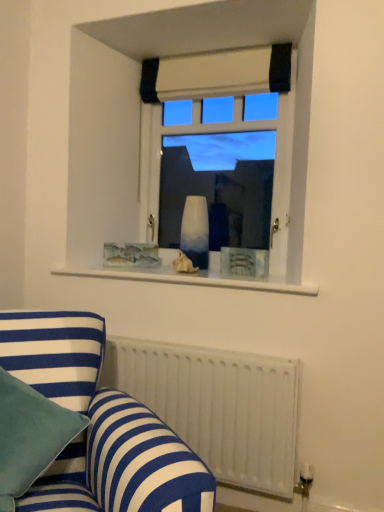
What do you see at coordinates (195, 231) in the screenshot? The width and height of the screenshot is (384, 512). I see `white glass vase at center` at bounding box center [195, 231].

The height and width of the screenshot is (512, 384). I want to click on beige fabric curtain at upper center, so click(217, 74).

Image resolution: width=384 pixels, height=512 pixels. What do you see at coordinates (217, 74) in the screenshot?
I see `beige fabric curtain at upper center` at bounding box center [217, 74].

Identify the location of white glass vase at upper center. This screenshot has height=512, width=384. (215, 74).

What is the approximate height of white glass vase at upper center?

white glass vase at upper center is 3.95 feet in height.

Identify the location of white metallic radiator at lower right. The image size is (384, 512). (218, 407).

Is blue striped fabric couch at lower left smaller than white metallic radiator at lower right?

No.

Is blue striped fabric couch at lower left closer to the viewer compared to white metallic radiator at lower right?

Yes, the depth of blue striped fabric couch at lower left is less than that of white metallic radiator at lower right.

Between blue striped fabric couch at lower left and white metallic radiator at lower right, which one has less height?

With less height is white metallic radiator at lower right.

Is the surface of blue striped fabric couch at lower left in direct contact with beige fabric curtain at upper center?

No, blue striped fabric couch at lower left is not with beige fabric curtain at upper center.

From a real-world perspective, is blue striped fabric couch at lower left physically below beige fabric curtain at upper center?

Correct, in the physical world, blue striped fabric couch at lower left is lower than beige fabric curtain at upper center.

Does point (95, 314) lie behind point (217, 93)?

No, it is not.

Looking at this image, which is more to the right, beige fabric curtain at upper center or teal velvet pillow at lower left?

beige fabric curtain at upper center is more to the right.

Does beige fabric curtain at upper center touch teal velvet pillow at lower left?

No, beige fabric curtain at upper center is not touching teal velvet pillow at lower left.

Looking at their sizes, would you say beige fabric curtain at upper center is wider or thinner than teal velvet pillow at lower left?

Clearly, beige fabric curtain at upper center has less width compared to teal velvet pillow at lower left.

Does beige fabric curtain at upper center turn towards teal velvet pillow at lower left?

No.

Which is behind, white glass vase at center or blue striped fabric couch at lower left?

Positioned behind is white glass vase at center.

Considering the sizes of white glass vase at center and blue striped fabric couch at lower left in the image, is white glass vase at center wider or thinner than blue striped fabric couch at lower left?

white glass vase at center is thinner than blue striped fabric couch at lower left.

Find the location of a particular element. The height and width of the screenshot is (512, 384). table lamp that appears above the blue striped fabric couch at lower left (from a real-world perspective) is located at coordinates (195, 231).

Is blue striped fabric couch at lower left completely or partially inside white glass vase at center?

No, blue striped fabric couch at lower left is not surrounded by white glass vase at center.

From a real-world perspective, which object stands above the other?

In real-world perspective, beige fabric curtain at upper center is above.

Considering the sizes of objects teal velvet pillow at lower left and beige fabric curtain at upper center in the image provided, who is thinner, teal velvet pillow at lower left or beige fabric curtain at upper center?

beige fabric curtain at upper center.

Is beige fabric curtain at upper center at the back of teal velvet pillow at lower left?

teal velvet pillow at lower left is not turned away from beige fabric curtain at upper center.

Based on the photo, considering the sizes of white glass vase at upper center and white metallic radiator at lower right in the image, is white glass vase at upper center wider or thinner than white metallic radiator at lower right?

In the image, white glass vase at upper center appears to be more narrow than white metallic radiator at lower right.

Is white glass vase at upper center positioned with its back to white metallic radiator at lower right?

No, white metallic radiator at lower right is not at the back of white glass vase at upper center.

Is there a large distance between white glass vase at upper center and white metallic radiator at lower right?

They are positioned close to each other.

Is blue striped fabric couch at lower left inside teal velvet pillow at lower left?

That's incorrect, blue striped fabric couch at lower left is not inside teal velvet pillow at lower left.

Consider the image. Is teal velvet pillow at lower left taller than blue striped fabric couch at lower left?

No, teal velvet pillow at lower left is not taller than blue striped fabric couch at lower left.

Considering the sizes of objects teal velvet pillow at lower left and blue striped fabric couch at lower left in the image provided, who is thinner, teal velvet pillow at lower left or blue striped fabric couch at lower left?

teal velvet pillow at lower left is thinner.

Are teal velvet pillow at lower left and blue striped fabric couch at lower left making contact?

There is a gap between teal velvet pillow at lower left and blue striped fabric couch at lower left.

Image resolution: width=384 pixels, height=512 pixels. Identify the location of radiator beneath the blue striped fabric couch at lower left (from a real-world perspective). (218, 407).

The height and width of the screenshot is (512, 384). Identify the location of curtain above the blue striped fabric couch at lower left (from the image's perspective). (217, 74).

When comparing their distances from beige fabric curtain at upper center, does white glass vase at upper center or white glass vase at center seem further?

white glass vase at center.

Which object lies further to the anchor point white glass vase at center, teal velvet pillow at lower left or white glass vase at upper center?

teal velvet pillow at lower left is positioned further to the anchor white glass vase at center.

Considering their positions, is beige fabric curtain at upper center positioned closer to white glass vase at upper center than teal velvet pillow at lower left?

The object closer to white glass vase at upper center is beige fabric curtain at upper center.

Considering their positions, is white glass vase at center positioned closer to white glass vase at upper center than white metallic radiator at lower right?

white glass vase at center is closer to white glass vase at upper center.

Consider the image. Estimate the real-world distances between objects in this image. Which object is further from white glass vase at upper center, blue striped fabric couch at lower left or white glass vase at center?

Based on the image, blue striped fabric couch at lower left appears to be further to white glass vase at upper center.

Estimate the real-world distances between objects in this image. Which object is further from white glass vase at upper center, beige fabric curtain at upper center or white glass vase at center?

white glass vase at center.

Estimate the real-world distances between objects in this image. Which object is closer to blue striped fabric couch at lower left, beige fabric curtain at upper center or teal velvet pillow at lower left?

teal velvet pillow at lower left.

From the image, which object appears to be farther from blue striped fabric couch at lower left, teal velvet pillow at lower left or white metallic radiator at lower right?

The object further to blue striped fabric couch at lower left is white metallic radiator at lower right.

I want to click on curtain located between teal velvet pillow at lower left and white glass vase at upper center in the depth direction, so click(217, 74).

This screenshot has height=512, width=384. Identify the location of table lamp between white glass vase at upper center and white metallic radiator at lower right vertically. (195, 231).

I want to click on studio couch between beige fabric curtain at upper center and white metallic radiator at lower right in the vertical direction, so click(99, 425).

You are a GUI agent. You are given a task and a screenshot of the screen. Output one action in this format:
    pyautogui.click(x=<x>, y=<y>)
    Task: Click on the radiator between blue striped fabric couch at lower left and white glass vase at center from front to back
    The height and width of the screenshot is (512, 384).
    Given the screenshot: What is the action you would take?
    tap(218, 407)